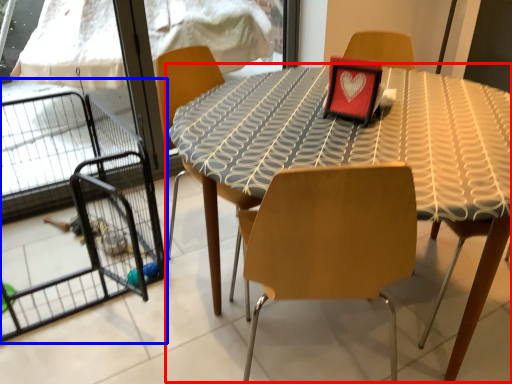
Question: Which object is closer to the camera taking this photo, table (highlighted by a red box) or cage (highlighted by a blue box)?

Choices:
 (A) table
 (B) cage

Answer: (A)